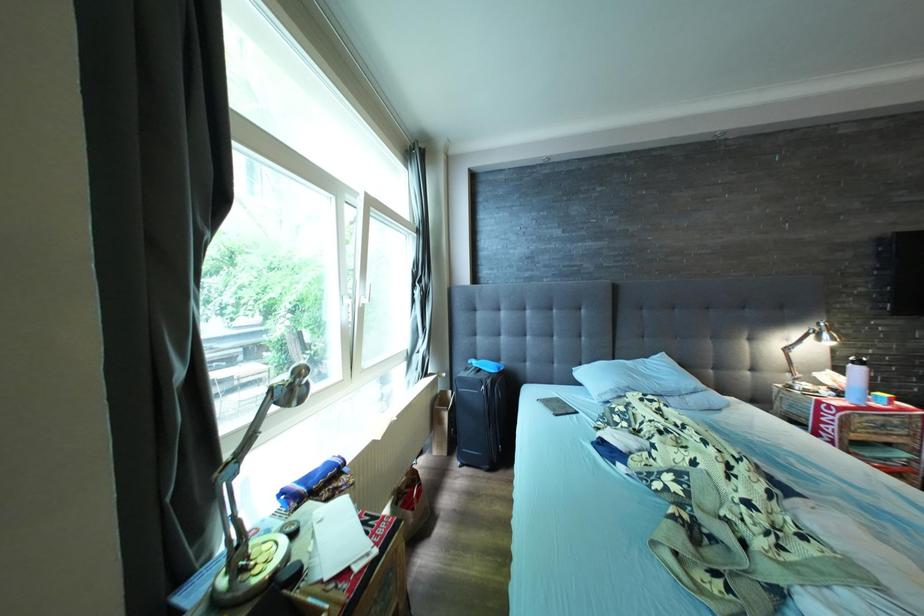
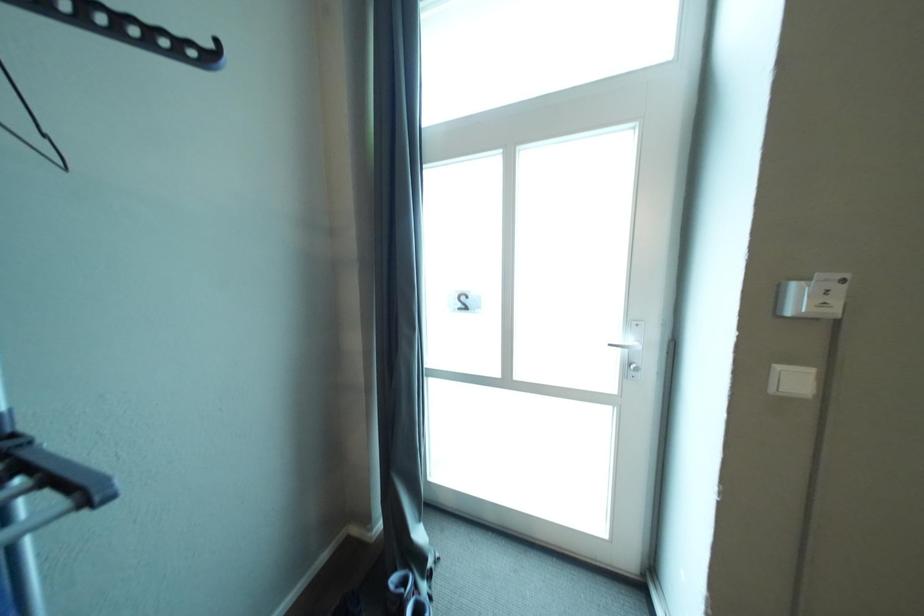
Question: The camera is either moving clockwise (left) or counter-clockwise (right) around the object. The first image is from the beginning of the video and the second image is from the end. Is the camera moving left or right when shooting the video?

Choices:
 (A) Left
 (B) Right

Answer: (B)